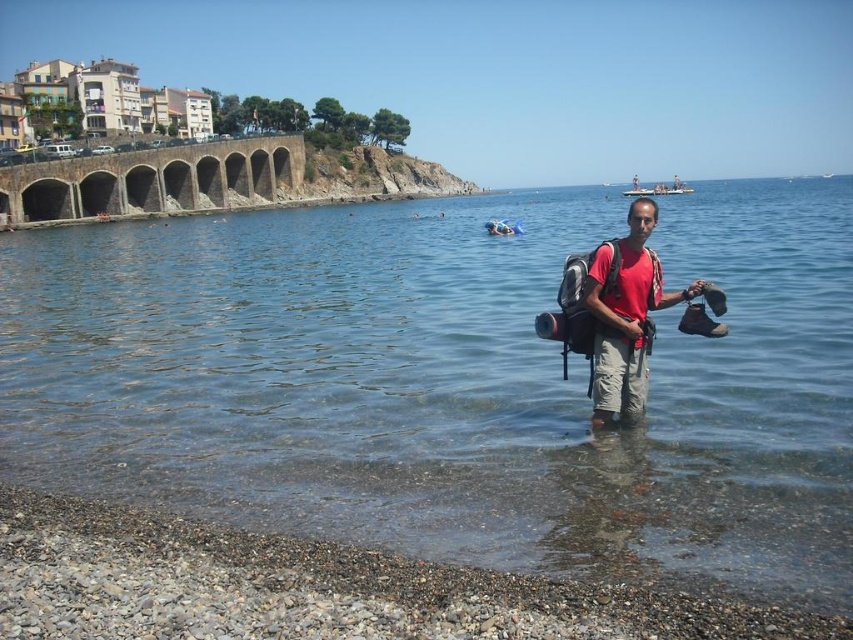
Does clear blue water at center appear over matte red t-shirt at center?

Yes, clear blue water at center is above matte red t-shirt at center.

Can you confirm if clear blue water at center is thinner than matte red t-shirt at center?

Incorrect, clear blue water at center's width is not less than matte red t-shirt at center's.

Find the location of a particular element. The height and width of the screenshot is (640, 853). clear blue water at center is located at coordinates (450, 381).

Who is shorter, clear blue water at center or smooth pebbles at lower left?

Standing shorter between the two is smooth pebbles at lower left.

Which is behind, point (631, 528) or point (448, 628)?

The point (631, 528) is behind.

Does point (836, 246) come closer to viewer compared to point (292, 573)?

No, it is behind (292, 573).

Find the location of a particular element. This screenshot has width=853, height=640. clear blue water at center is located at coordinates (450, 381).

Is point (160, 636) closer to viewer compared to point (601, 298)?

Yes, point (160, 636) is in front of point (601, 298).

Which is more to the right, smooth pebbles at lower left or matte red t-shirt at center?

matte red t-shirt at center

Based on the photo, who is more forward, (10, 540) or (618, 333)?

Point (10, 540) is more forward.

You are a GUI agent. You are given a task and a screenshot of the screen. Output one action in this format:
    pyautogui.click(x=<x>, y=<y>)
    Task: Click on the smooth pebbles at lower left
    The image size is (853, 640).
    Given the screenshot: What is the action you would take?
    pyautogui.click(x=316, y=588)